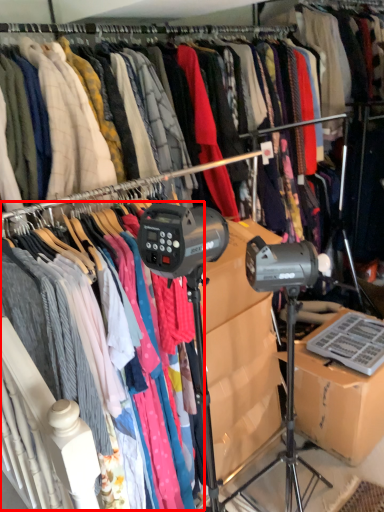
Question: Where is clothing (annotated by the red box) located in relation to cardboard box in the image?

Choices:
 (A) left
 (B) right

Answer: (A)